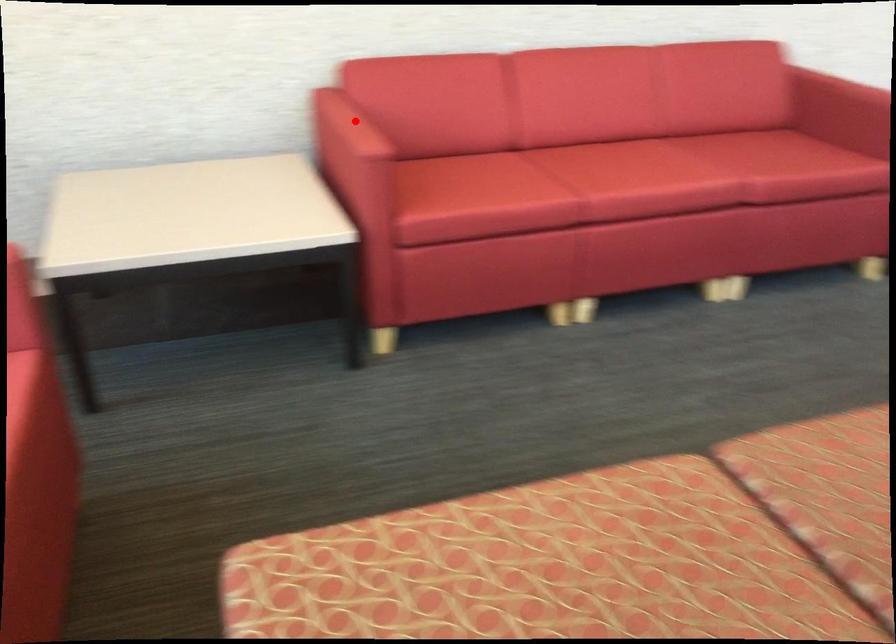
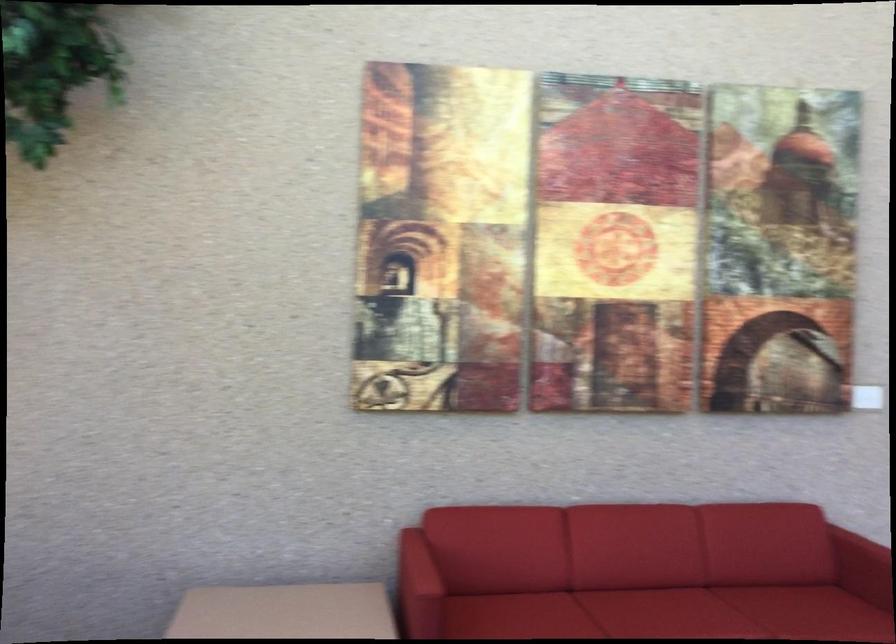
Question: A red point is marked in image1. In image2, is the corresponding 3D point closer to the camera or farther? Reply with the corresponding letter.

Choices:
 (A) The corresponding 3D point is closer.
 (B) The corresponding 3D point is farther.

Answer: (B)